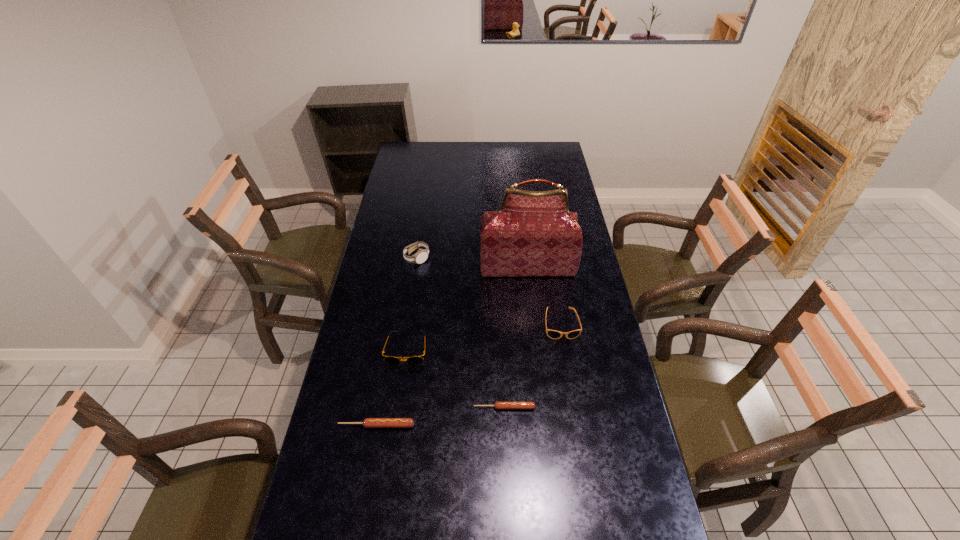
In order to click on the taller sausage in this screenshot , I will do `click(368, 422)`.

Find the location of a particular element. Image resolution: width=960 pixels, height=540 pixels. the nearer sausage is located at coordinates (368, 422).

Where is `the right sausage`? the right sausage is located at coordinates (498, 405).

Where is `the farther sausage`? The width and height of the screenshot is (960, 540). the farther sausage is located at coordinates (498, 405).

I want to click on the left sunglasses, so click(x=414, y=360).

This screenshot has height=540, width=960. I want to click on the right sunglasses, so click(x=553, y=334).

Where is `the tallest object`? The height and width of the screenshot is (540, 960). the tallest object is located at coordinates (533, 234).

The width and height of the screenshot is (960, 540). I want to click on the second tallest object, so click(421, 255).

At what (x,y) coordinates should I click in order to perform the action: click on vacant space situated on the right of the taller sausage. Please return your answer as a coordinate pair (x, y). The image size is (960, 540). Looking at the image, I should click on (481, 425).

This screenshot has height=540, width=960. What are the coordinates of `free space located 0.190m on the front of the farther sausage` in the screenshot? It's located at (507, 474).